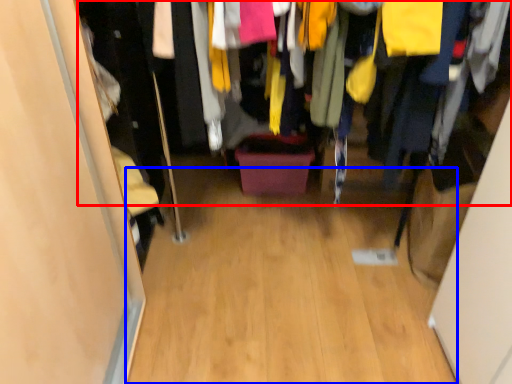
Question: Which of the following is the closest to the observer, closet (highlighted by a red box) or plain (highlighted by a blue box)?

Choices:
 (A) closet
 (B) plain

Answer: (A)